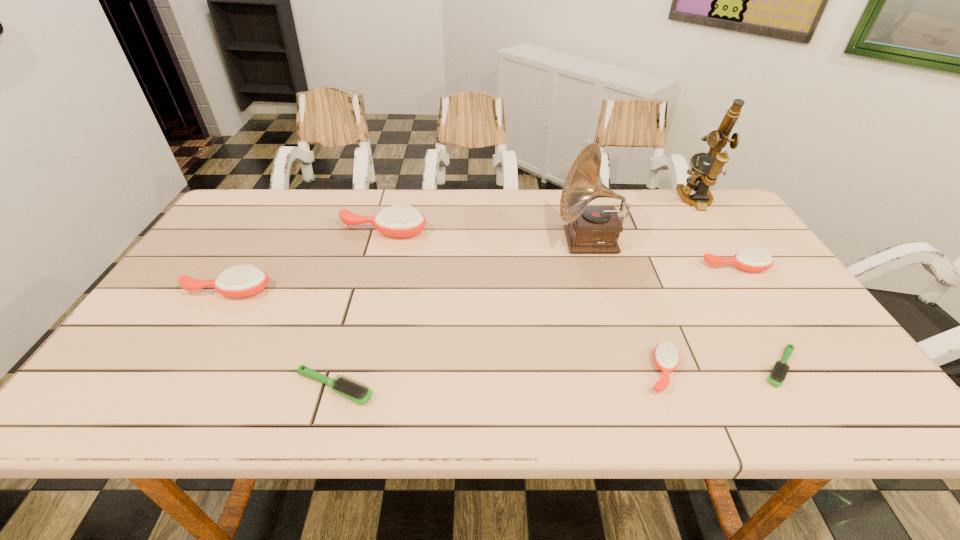
Locate an element on the screen. vacant area that lies between the right light hairbrush and the second shortest object is located at coordinates (558, 377).

The image size is (960, 540). I want to click on vacant point located between the shortest hairbrush and the brown phonograph record, so click(684, 304).

Where is `free space between the fifth nearest hairbrush and the shortest hairbrush`? Image resolution: width=960 pixels, height=540 pixels. free space between the fifth nearest hairbrush and the shortest hairbrush is located at coordinates (758, 318).

This screenshot has height=540, width=960. I want to click on empty location between the farthest object and the fifth shortest object, so click(462, 246).

Where is `vacant region between the third smallest orange hairbrush and the fifth tallest hairbrush`? The image size is (960, 540). vacant region between the third smallest orange hairbrush and the fifth tallest hairbrush is located at coordinates (281, 339).

At what (x,y) coordinates should I click in order to perform the action: click on vacant region between the farthest object and the left light hairbrush. Please return your answer as a coordinate pair (x, y). Image resolution: width=960 pixels, height=540 pixels. Looking at the image, I should click on (515, 294).

The image size is (960, 540). In order to click on free point between the fifth tallest hairbrush and the leftmost orange hairbrush in this screenshot , I will do `click(281, 339)`.

Locate an element on the screen. Image resolution: width=960 pixels, height=540 pixels. object that is the fifth closest to the shortest hairbrush is located at coordinates (351, 390).

Where is `object that is the closest to the fourth tallest object`? The image size is (960, 540). object that is the closest to the fourth tallest object is located at coordinates (397, 221).

Locate an element on the screen. hairbrush that stands as the third closest to the biggest orange hairbrush is located at coordinates (666, 357).